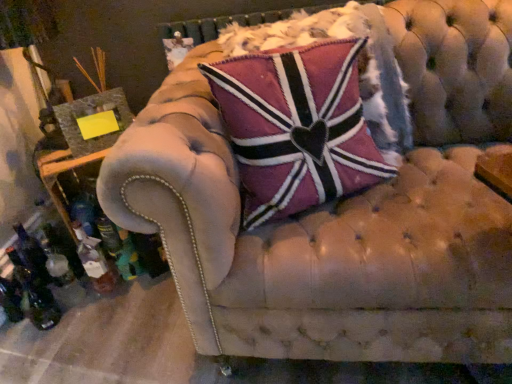
Question: Is pink velvet pillow at center oriented towards translucent glass bottle at lower left?

Choices:
 (A) yes
 (B) no

Answer: (B)

Question: Considering the relative sizes of pink velvet pillow at center and translucent glass bottle at lower left in the image provided, is pink velvet pillow at center wider than translucent glass bottle at lower left?

Choices:
 (A) yes
 (B) no

Answer: (A)

Question: From a real-world perspective, is pink velvet pillow at center beneath translucent glass bottle at lower left?

Choices:
 (A) no
 (B) yes

Answer: (A)

Question: Is pink velvet pillow at center to the right of translucent glass bottle at lower left from the viewer's perspective?

Choices:
 (A) yes
 (B) no

Answer: (A)

Question: Is pink velvet pillow at center taller than translucent glass bottle at lower left?

Choices:
 (A) no
 (B) yes

Answer: (B)

Question: Considering the relative sizes of pink velvet pillow at center and translucent glass bottle at lower left in the image provided, is pink velvet pillow at center shorter than translucent glass bottle at lower left?

Choices:
 (A) no
 (B) yes

Answer: (A)

Question: Is translucent glass bottle at lower left taller than pink velvet pillow at center?

Choices:
 (A) no
 (B) yes

Answer: (A)

Question: Is translucent glass bottle at lower left behind pink velvet pillow at center?

Choices:
 (A) yes
 (B) no

Answer: (A)

Question: Considering the relative sizes of translucent glass bottle at lower left and pink velvet pillow at center in the image provided, is translucent glass bottle at lower left thinner than pink velvet pillow at center?

Choices:
 (A) no
 (B) yes

Answer: (B)

Question: Can pink velvet pillow at center be found inside translucent glass bottle at lower left?

Choices:
 (A) no
 (B) yes

Answer: (A)

Question: From the image's perspective, does translucent glass bottle at lower left appear lower than pink velvet pillow at center?

Choices:
 (A) yes
 (B) no

Answer: (A)

Question: From a real-world perspective, is translucent glass bottle at lower left physically below pink velvet pillow at center?

Choices:
 (A) yes
 (B) no

Answer: (A)

Question: Considering the positions of translucent glass bottle at lower left and pink velvet pillow at center in the image, is translucent glass bottle at lower left wider or thinner than pink velvet pillow at center?

Choices:
 (A) thin
 (B) wide

Answer: (A)